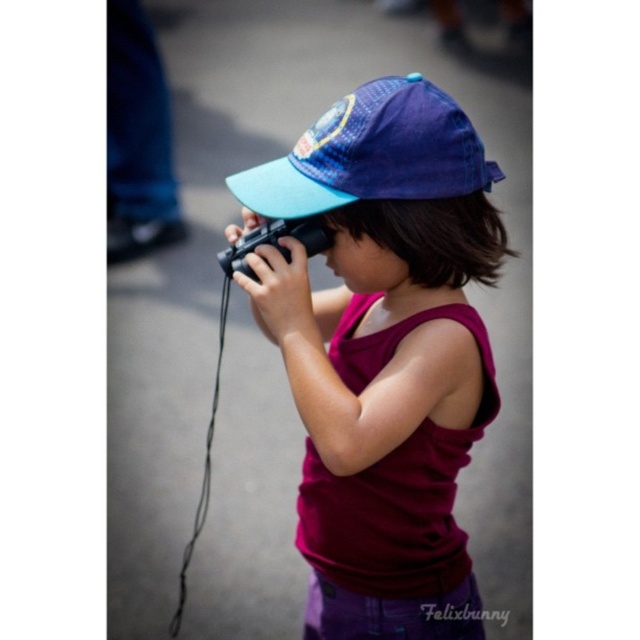
Is point (460, 168) less distant than point (364, 150)?

No, it is not.

Find the location of a particular element. matte blue cap at center is located at coordinates (381, 353).

Can you confirm if matte blue cap at center is thinner than black plastic camera at center?

No, matte blue cap at center is not thinner than black plastic camera at center.

In order to click on matte blue cap at center in this screenshot , I will do `click(381, 353)`.

Identify the location of matte blue cap at center. The width and height of the screenshot is (640, 640). (381, 353).

Looking at this image, can you confirm if blue fabric baseball cap at center is positioned below black plastic camera at center?

Actually, blue fabric baseball cap at center is above black plastic camera at center.

Who is lower down, blue fabric baseball cap at center or black plastic camera at center?

black plastic camera at center is lower down.

Who is more forward, (403,84) or (308,224)?

Point (403,84) is more forward.

The height and width of the screenshot is (640, 640). Identify the location of blue fabric baseball cap at center. (372, 154).